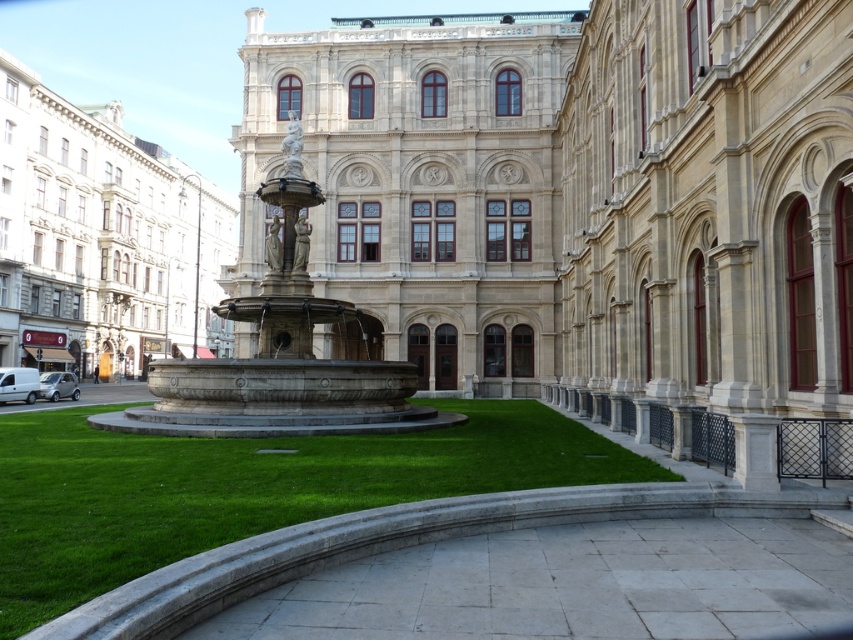
You are a visitor at the grand building and want to find the entrance. The entrance is located where the green grass at center and stone fountain at center are positioned relative to each other. According to their positions, where is the entrance likely located?

The entrance is likely located to the left of the stone fountain at center because the green grass at center is to the right of it, and entrances are often flanked by such features.

You are a visitor to the building and want to take a photo of the stone fountain at center from the front entrance. Is the green grass at center blocking your view of the fountain?

The green grass at center is shorter than the stone fountain at center, so it is unlikely to block the view of the fountain from the front entrance.